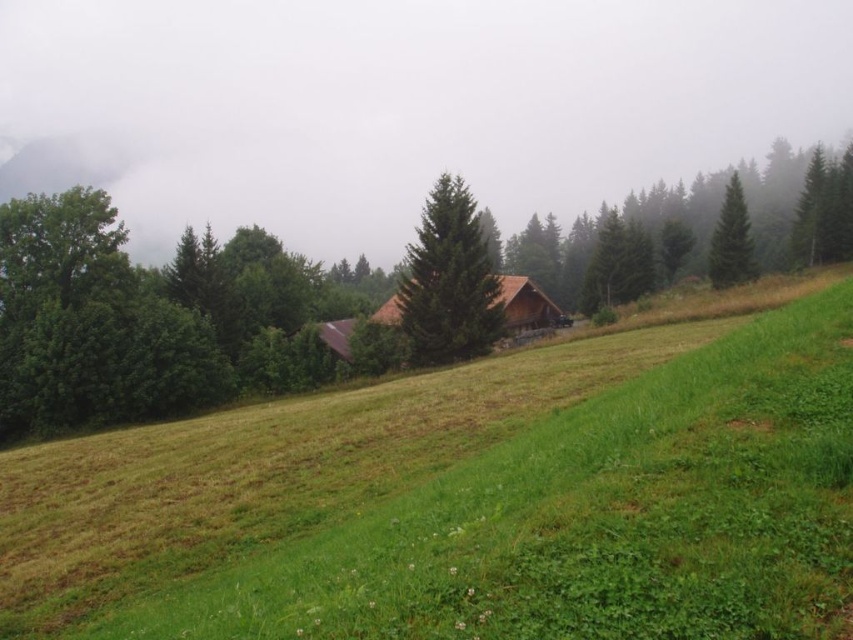
Question: Does green wood tree at upper right appear over green matte tree at center?

Choices:
 (A) no
 (B) yes

Answer: (B)

Question: Does green grassy field at center appear over green matte tree at center?

Choices:
 (A) no
 (B) yes

Answer: (A)

Question: Can you confirm if green grassy field at center is wider than green matte tree at upper right?

Choices:
 (A) yes
 (B) no

Answer: (B)

Question: Which of these objects is positioned closest to the green wood tree at upper right?

Choices:
 (A) green matte tree at upper right
 (B) green leafy forest at center
 (C) green matte tree at center
 (D) green grassy field at center

Answer: (B)

Question: Based on their relative distances, which object is nearer to the green leafy forest at center?

Choices:
 (A) green matte tree at center
 (B) green wood tree at upper right
 (C) green grassy field at center

Answer: (B)

Question: Which of these objects is positioned farthest from the green wood tree at upper right?

Choices:
 (A) green matte tree at upper right
 (B) green leafy forest at center
 (C) green grassy field at center
 (D) green matte tree at center

Answer: (C)